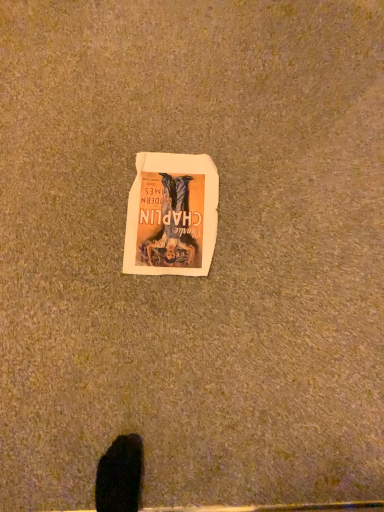
You are a GUI agent. You are given a task and a screenshot of the screen. Output one action in this format:
    pyautogui.click(x=<x>, y=<y>)
    Task: Click on the free spot to the right of matte paper poster at center
    The width and height of the screenshot is (384, 512).
    Given the screenshot: What is the action you would take?
    pyautogui.click(x=258, y=226)